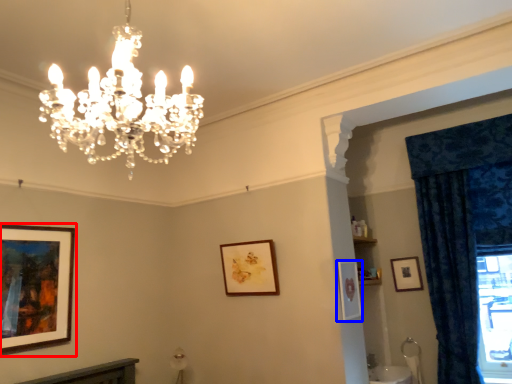
Question: Which point is closer to the camera, picture frame (highlighted by a red box) or picture frame (highlighted by a blue box)?

Choices:
 (A) picture frame
 (B) picture frame

Answer: (A)